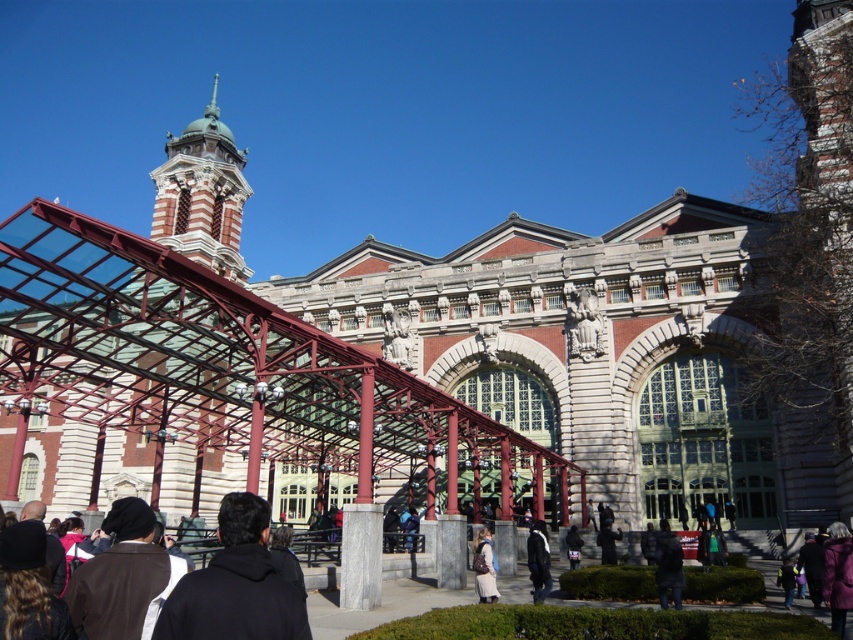
Who is shorter, dark gray jacket at lower right or dark blue leather jacket at center?

Standing shorter between the two is dark blue leather jacket at center.

The height and width of the screenshot is (640, 853). Identify the location of dark gray jacket at lower right. (668, 564).

Can you confirm if dark gray jacket at center is positioned below dark gray fabric jacket at lower center?

No, dark gray jacket at center is not below dark gray fabric jacket at lower center.

Identify the location of dark gray jacket at center. (607, 541).

Locate an element on the screen. Image resolution: width=853 pixels, height=640 pixels. dark gray jacket at center is located at coordinates (607, 541).

Which is in front, point (225, 564) or point (479, 566)?

Point (225, 564) is more forward.

The width and height of the screenshot is (853, 640). What do you see at coordinates (235, 586) in the screenshot? I see `black hoodie at center` at bounding box center [235, 586].

Is point (233, 497) in front of point (479, 582)?

Yes, point (233, 497) is in front of point (479, 582).

Find the location of a particular element. The width and height of the screenshot is (853, 640). black hoodie at center is located at coordinates (235, 586).